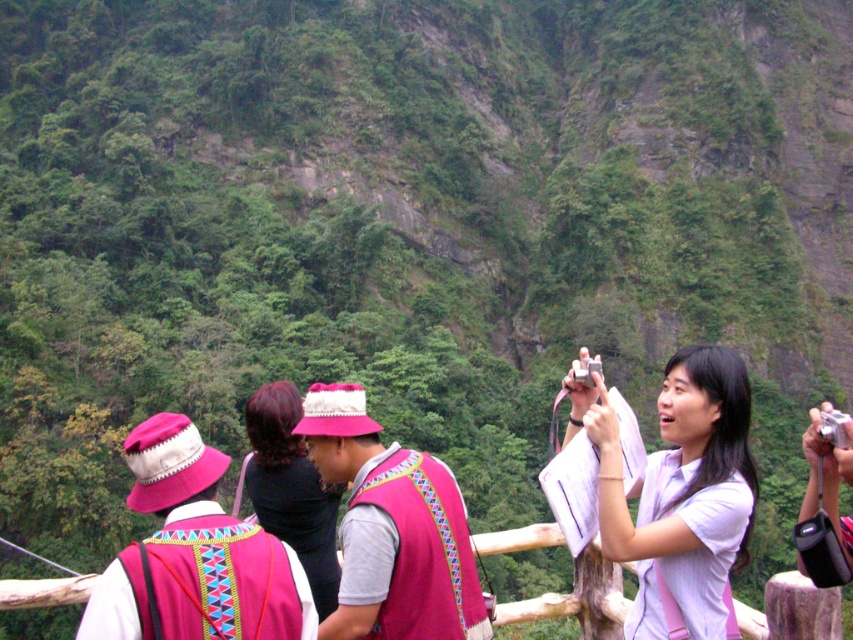
From the picture: Which of these two, white matte shirt at center or silver metallic camera at upper right, stands taller?

silver metallic camera at upper right

Does white matte shirt at center have a lesser width compared to silver metallic camera at upper right?

Indeed, white matte shirt at center has a lesser width compared to silver metallic camera at upper right.

Which is in front, point (695, 483) or point (804, 513)?

Point (804, 513) is in front.

The height and width of the screenshot is (640, 853). What are the coordinates of `white matte shirt at center` in the screenshot? It's located at (679, 492).

Is pink fabric vest at center below silver metallic camera at upper right?

No, pink fabric vest at center is not below silver metallic camera at upper right.

Is pink fabric vest at center taller than silver metallic camera at upper right?

No.

Does point (334, 620) lie behind point (846, 570)?

That is True.

This screenshot has height=640, width=853. I want to click on pink fabric vest at center, so click(392, 529).

Does point (601, 422) come closer to viewer compared to point (310, 490)?

Yes, point (601, 422) is in front of point (310, 490).

The image size is (853, 640). What do you see at coordinates (679, 492) in the screenshot?
I see `white matte shirt at center` at bounding box center [679, 492].

You are a GUI agent. You are given a task and a screenshot of the screen. Output one action in this format:
    pyautogui.click(x=<x>, y=<y>)
    Task: Click on the white matte shirt at center
    This screenshot has height=640, width=853.
    Given the screenshot: What is the action you would take?
    pyautogui.click(x=679, y=492)